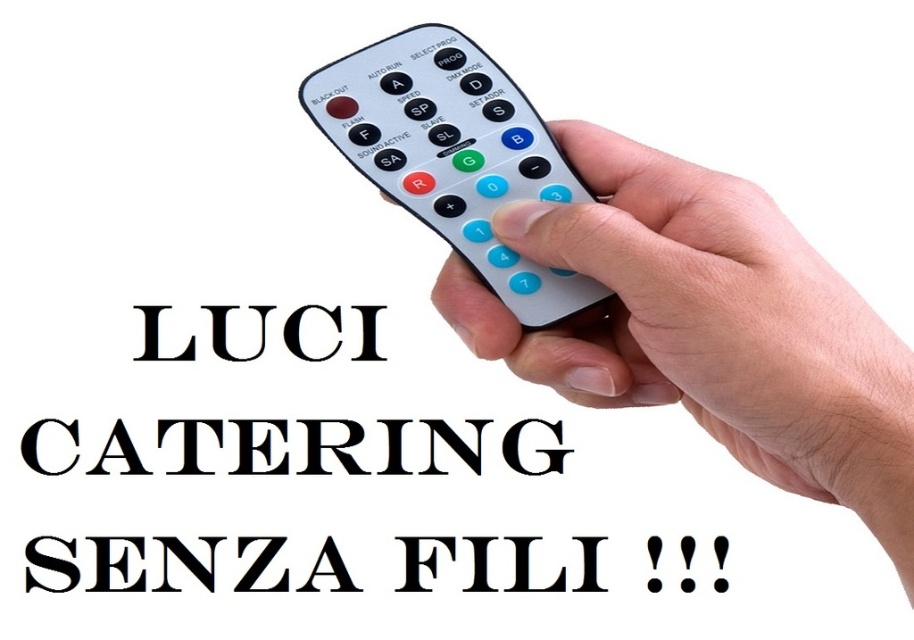
You are setting up a presentation and need to identify the remote control buttons. Which object is shorter between the black matte catering at center and the black solid text at center?

The black matte catering at center is shorter than the black solid text at center.

Consider the image. You are trying to read the text on the black paper text at center but there is a white plastic remote at center in the way. Can you see the text clearly?

The white plastic remote at center is in front of the black paper text at center, so the remote is blocking the text making it hard to see clearly.

You are trying to locate the black matte catering at center and the black solid text at center on the remote control. Which one is closer to you?

The black matte catering at center is closer to you because it is in front of the black solid text at center.